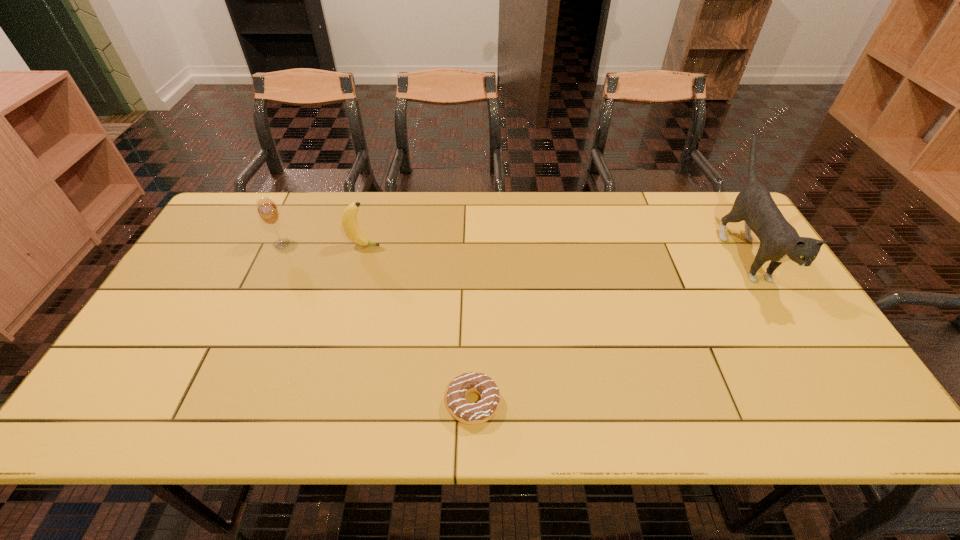
This screenshot has width=960, height=540. I want to click on vacant area between the wineglass and the banana, so click(323, 245).

Locate an element on the screen. object identified as the third closest to the tallest object is located at coordinates (268, 212).

Locate an element on the screen. object that stands as the third closest to the cat is located at coordinates (268, 212).

At what (x,y) coordinates should I click in order to perform the action: click on vacant space that satisfies the following two spatial constraints: 1. from the stem of the nearest object; 2. on the right side of the third object from right to left. Please return your answer as a coordinate pair (x, y). Looking at the image, I should click on (322, 403).

Where is `blank area in the image that satisfies the following two spatial constraints: 1. from the stem of the banana; 2. on the back side of the second object from right to left`? The image size is (960, 540). blank area in the image that satisfies the following two spatial constraints: 1. from the stem of the banana; 2. on the back side of the second object from right to left is located at coordinates (322, 403).